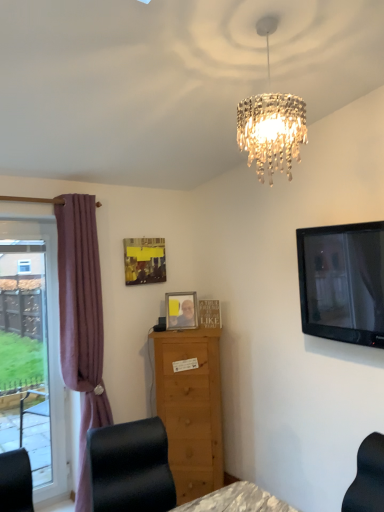
Question: Visually, is matte yellow picture frame at upper center, which is the 3th picture frame from right to left, positioned to the left or to the right of wooden picture frame at center, positioned as the 1th picture frame in right-to-left order?

Choices:
 (A) left
 (B) right

Answer: (A)

Question: Relative to wooden picture frame at center, which is the 3th picture frame in left-to-right order, is matte yellow picture frame at upper center, which is the 3th picture frame from right to left, in front or behind?

Choices:
 (A) behind
 (B) front

Answer: (A)

Question: Which object is positioned farthest from the black leather chair at lower left?

Choices:
 (A) light brown wooden chest of drawers at center
 (B) black glossy tv at upper right
 (C) matte yellow picture frame at upper center, which is the 3th picture frame from right to left
 (D) wooden picture frame at center, positioned as the 1th picture frame in right-to-left order
 (E) matte plastic picture frame at center, which is the 2th picture frame from right to left

Answer: (C)

Question: Which object is positioned farthest from the mauve fabric curtain at left?

Choices:
 (A) matte yellow picture frame at upper center, which is the first picture frame in left-to-right order
 (B) wooden picture frame at center, which is the 3th picture frame in left-to-right order
 (C) clear glass window at left
 (D) matte plastic picture frame at center, which is the 2th picture frame from right to left
 (E) light brown wooden chest of drawers at center

Answer: (B)